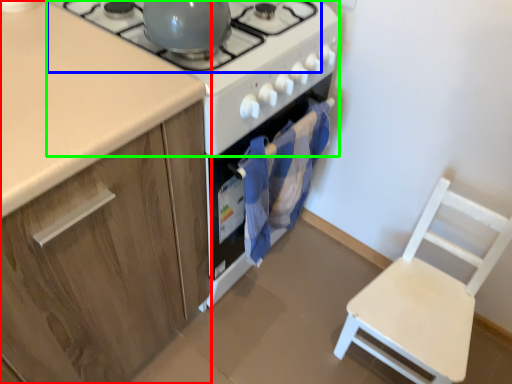
Question: Based on their relative distances, which object is farther from cabinetry (highlighted by a red box)? Choose from gas stove (highlighted by a blue box) and gas stove (highlighted by a green box).

Choices:
 (A) gas stove
 (B) gas stove

Answer: (A)